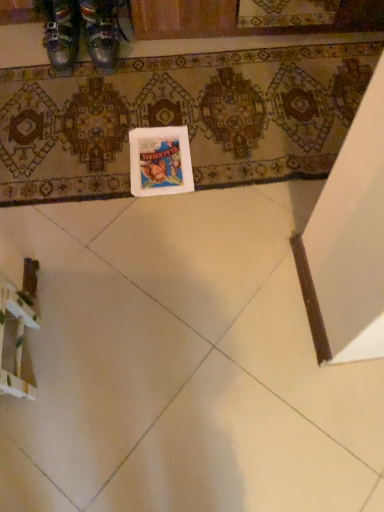
This screenshot has width=384, height=512. I want to click on vacant location below patterned carpet at center (from a real-world perspective), so click(206, 112).